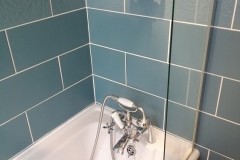
At what (x,y) coordinates should I click in order to perform the action: click on horizontal grout line. Please return your answer as a coordinate pair (x, y). Looking at the image, I should click on (35, 21), (41, 103), (31, 67), (137, 88), (205, 147), (216, 74), (156, 17), (39, 138).